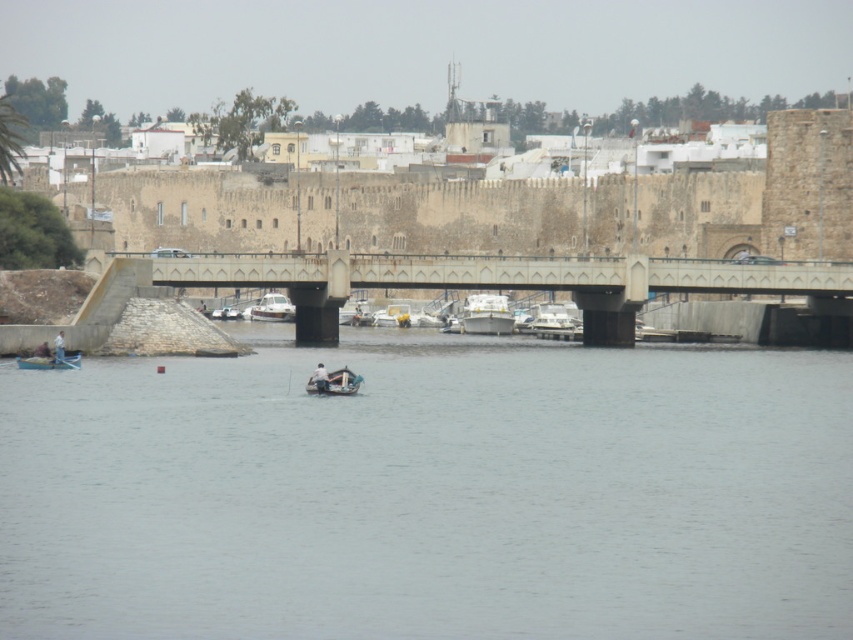
Does point (746, 374) lie in front of point (463, 324)?

Yes.

Who is more forward, (518,621) or (488,310)?

Point (518,621) is more forward.

Locate an element on the screen. gray smooth water at center is located at coordinates (430, 493).

Locate an element on the screen. gray smooth water at center is located at coordinates click(x=430, y=493).

Which is behind, point (276, 544) or point (318, 387)?

The point (318, 387) is behind.

Between point (218, 531) and point (332, 380), which one is positioned in front?

Point (218, 531) is in front.

Between point (692, 556) and point (318, 384), which one is positioned behind?

The point (318, 384) is behind.

Where is `gray smooth water at center`? gray smooth water at center is located at coordinates (430, 493).

Can you confirm if concrete bridge at center is wider than light blue fabric boat at lower left?

Indeed, concrete bridge at center has a greater width compared to light blue fabric boat at lower left.

Which is more to the right, concrete bridge at center or light blue fabric boat at lower left?

Positioned to the right is concrete bridge at center.

Locate an element on the screen. This screenshot has width=853, height=640. concrete bridge at center is located at coordinates (480, 282).